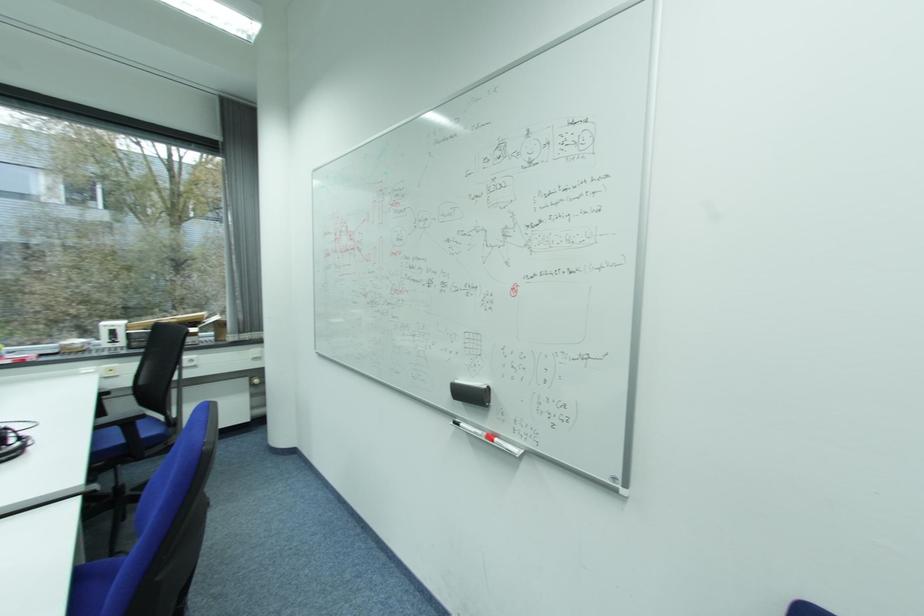
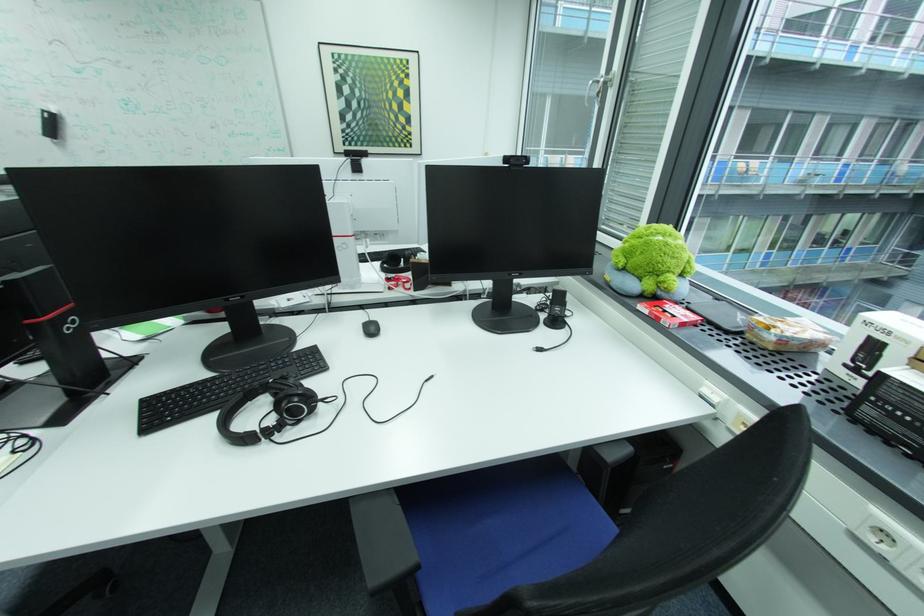
The point at (90, 346) is marked in the first image. Where is the corresponding point in the second image?

(781, 339)